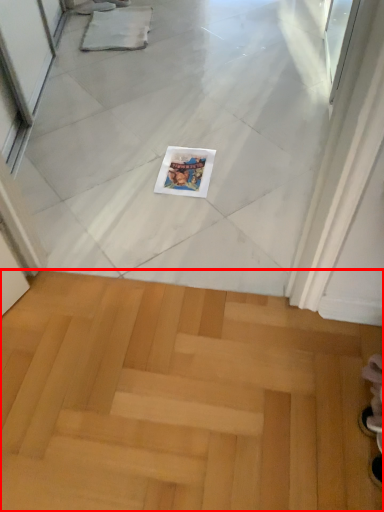
Question: Where is stairwell (annotated by the red box) located in relation to magazine in the image?

Choices:
 (A) left
 (B) right

Answer: (A)